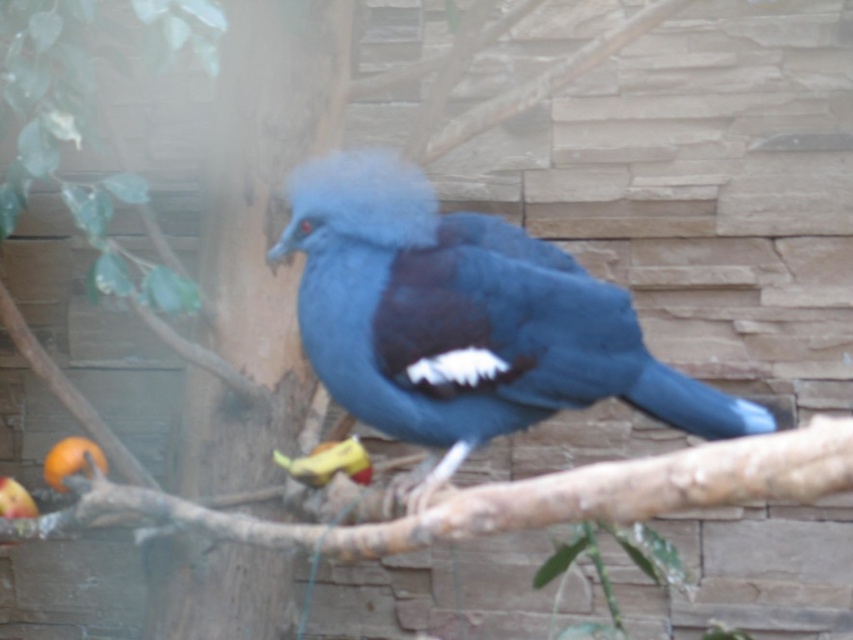
Who is positioned more to the left, brown rough wood at lower center or shiny blue parrot at center?

From the viewer's perspective, shiny blue parrot at center appears more on the left side.

Is brown rough wood at lower center thinner than shiny blue parrot at center?

In fact, brown rough wood at lower center might be wider than shiny blue parrot at center.

Which is behind, point (614, 476) or point (364, 460)?

Point (364, 460)

You are a GUI agent. You are given a task and a screenshot of the screen. Output one action in this format:
    pyautogui.click(x=<x>, y=<y>)
    Task: Click on the brown rough wood at lower center
    The width and height of the screenshot is (853, 640).
    Given the screenshot: What is the action you would take?
    pyautogui.click(x=509, y=497)

Which is above, brown rough wood at lower center or matte orange fruit at lower left?

brown rough wood at lower center

Identify the location of brown rough wood at lower center. The width and height of the screenshot is (853, 640). (509, 497).

Locate an element on the screen. brown rough wood at lower center is located at coordinates (509, 497).

Which is behind, point (309, 200) or point (339, 468)?

Positioned behind is point (339, 468).

Who is taller, matte blue bird at center or shiny blue parrot at center?

matte blue bird at center is taller.

Identify the location of matte blue bird at center. (463, 320).